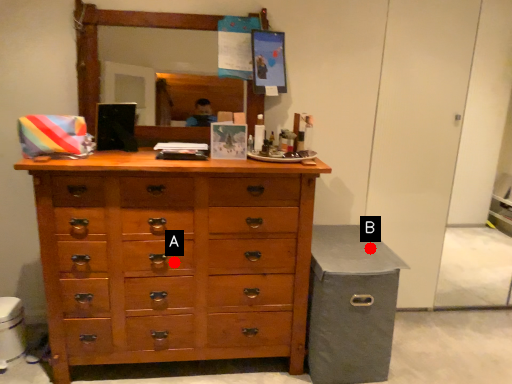
Question: Two points are circled on the image, labeled by A and B beside each circle. Which point appears closest to the camera in this image?

Choices:
 (A) A is closer
 (B) B is closer

Answer: (A)